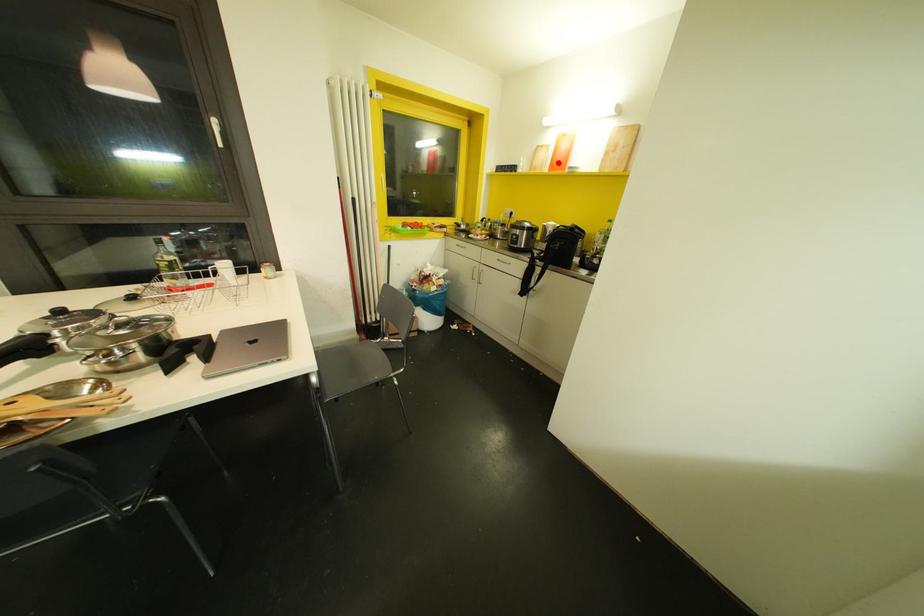
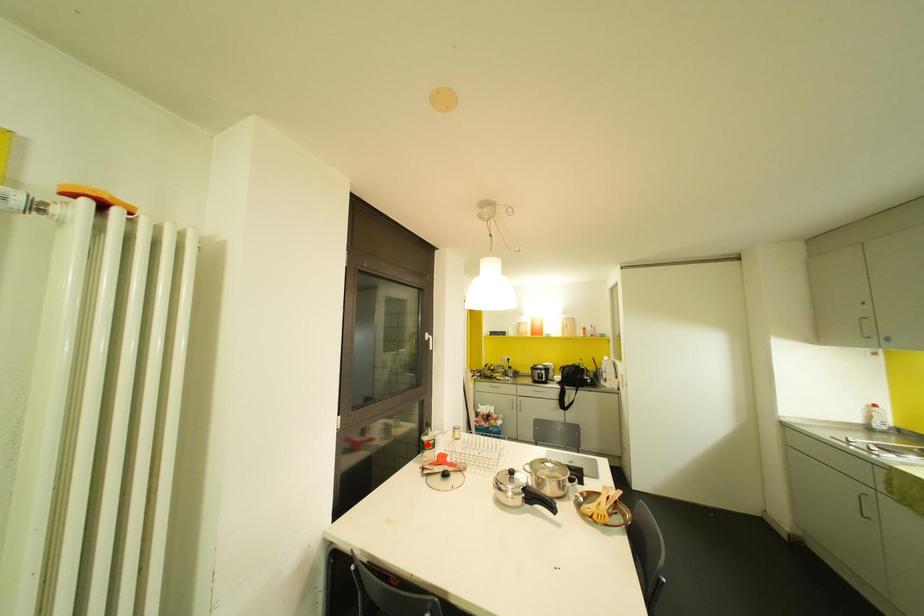
I am providing you with two images of the same scene from different viewpoints. A red point is marked on the first image and another point is marked on the second image. Does the point marked in image1 correspond to the same location as the one in image2?

No